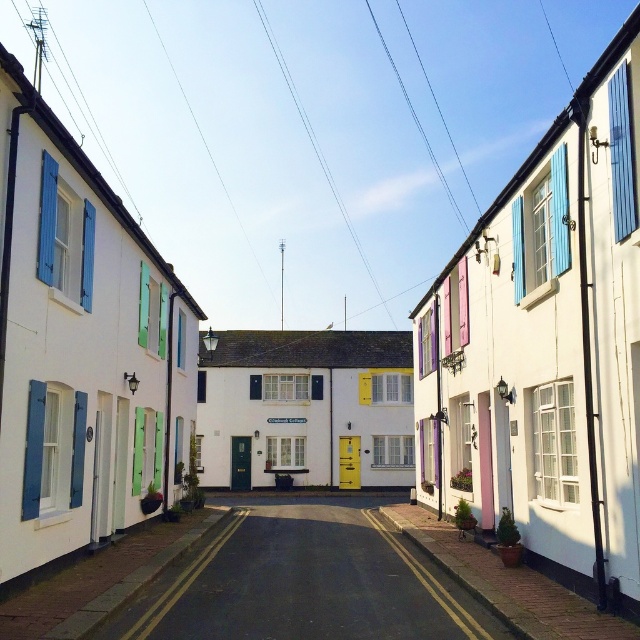
Question: Does smooth asphalt road at center appear over white matte house at center?

Choices:
 (A) no
 (B) yes

Answer: (A)

Question: Which point appears closest to the camera in this image?

Choices:
 (A) (541, 612)
 (B) (342, 337)

Answer: (A)

Question: Which point is closer to the camera?

Choices:
 (A) smooth asphalt road at center
 (B) white matte house at center

Answer: (A)

Question: Can you confirm if white matte house at center is positioned to the left of terracotta pot at lower right?

Choices:
 (A) no
 (B) yes

Answer: (B)

Question: Can you confirm if smooth asphalt road at center is thinner than white matte house at center?

Choices:
 (A) no
 (B) yes

Answer: (B)

Question: Which point appears farthest from the camera in this image?

Choices:
 (A) (273, 362)
 (B) (417, 532)
 (C) (410, 550)

Answer: (A)